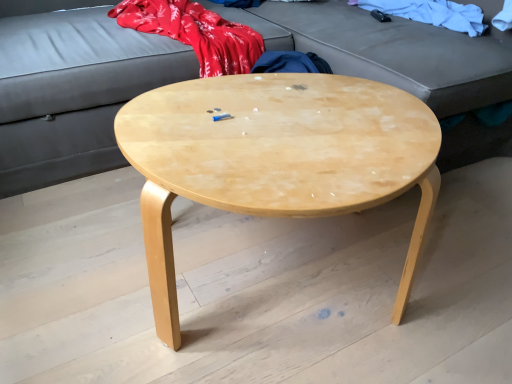
Question: From the image's perspective, would you say white cotton cloth at upper right is shown under natural wood coffee table at center?

Choices:
 (A) yes
 (B) no

Answer: (B)

Question: From a real-world perspective, is white cotton cloth at upper right positioned over natural wood coffee table at center based on gravity?

Choices:
 (A) no
 (B) yes

Answer: (B)

Question: Can we say white cotton cloth at upper right lies outside natural wood coffee table at center?

Choices:
 (A) no
 (B) yes

Answer: (B)

Question: Is white cotton cloth at upper right to the left of natural wood coffee table at center from the viewer's perspective?

Choices:
 (A) yes
 (B) no

Answer: (B)

Question: Is white cotton cloth at upper right shorter than natural wood coffee table at center?

Choices:
 (A) no
 (B) yes

Answer: (B)

Question: Is matte gray studio couch at upper center wider or thinner than white cotton cloth at upper right?

Choices:
 (A) wide
 (B) thin

Answer: (A)

Question: From a real-world perspective, is matte gray studio couch at upper center physically located above or below white cotton cloth at upper right?

Choices:
 (A) below
 (B) above

Answer: (A)

Question: In terms of size, does matte gray studio couch at upper center appear bigger or smaller than white cotton cloth at upper right?

Choices:
 (A) small
 (B) big

Answer: (B)

Question: Considering the positions of point (181, 69) and point (430, 19), is point (181, 69) closer or farther from the camera than point (430, 19)?

Choices:
 (A) closer
 (B) farther

Answer: (A)

Question: Is white cotton cloth at upper right bigger or smaller than natural wood coffee table at center?

Choices:
 (A) small
 (B) big

Answer: (A)

Question: Is white cotton cloth at upper right to the left or to the right of natural wood coffee table at center in the image?

Choices:
 (A) right
 (B) left

Answer: (A)

Question: From a real-world perspective, is white cotton cloth at upper right physically located above or below natural wood coffee table at center?

Choices:
 (A) below
 (B) above

Answer: (B)

Question: Looking at their shapes, would you say white cotton cloth at upper right is wider or thinner than natural wood coffee table at center?

Choices:
 (A) wide
 (B) thin

Answer: (B)

Question: Considering their positions, is natural wood coffee table at center located in front of or behind matte gray studio couch at upper center?

Choices:
 (A) behind
 (B) front

Answer: (B)

Question: Is natural wood coffee table at center wider or thinner than matte gray studio couch at upper center?

Choices:
 (A) thin
 (B) wide

Answer: (A)